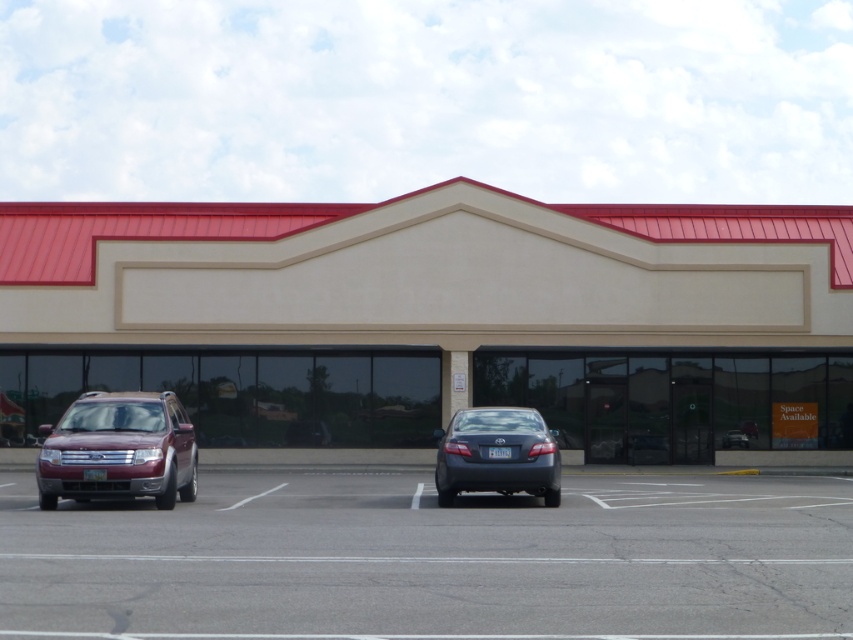
Question: Is gray asphalt parking lot at center above shiny maroon suv at left?

Choices:
 (A) no
 (B) yes

Answer: (A)

Question: Which is nearer to the gray metallic sedan at center?

Choices:
 (A) shiny maroon suv at left
 (B) beige smooth building at center
 (C) gray asphalt parking lot at center

Answer: (C)

Question: Is beige smooth building at center to the right of shiny maroon suv at left from the viewer's perspective?

Choices:
 (A) yes
 (B) no

Answer: (A)

Question: Estimate the real-world distances between objects in this image. Which object is closer to the gray asphalt parking lot at center?

Choices:
 (A) gray metallic sedan at center
 (B) beige smooth building at center
 (C) shiny maroon suv at left

Answer: (C)

Question: Which point appears farthest from the camera in this image?

Choices:
 (A) (793, 353)
 (B) (442, 500)
 (C) (102, 474)

Answer: (A)

Question: Is shiny maroon suv at left wider than gray metallic sedan at center?

Choices:
 (A) no
 (B) yes

Answer: (B)